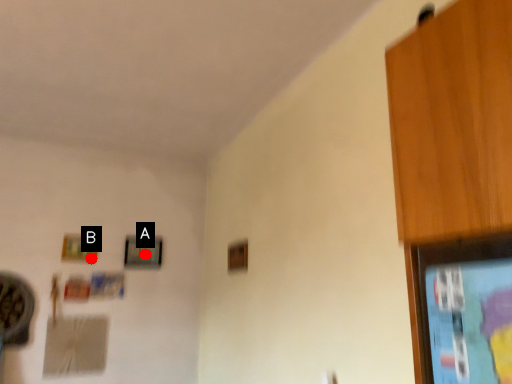
Question: Two points are circled on the image, labeled by A and B beside each circle. Which point is farther to the camera?

Choices:
 (A) A is further
 (B) B is further

Answer: (A)